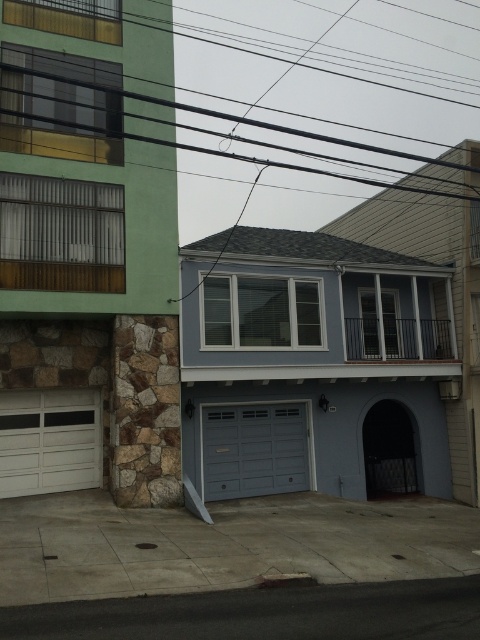
Is matte gray garage door at center thinner than black wire at upper center?

Correct, matte gray garage door at center's width is less than black wire at upper center's.

You are a GUI agent. You are given a task and a screenshot of the screen. Output one action in this format:
    pyautogui.click(x=<x>, y=<y>)
    Task: Click on the matte gray garage door at center
    The height and width of the screenshot is (640, 480).
    Given the screenshot: What is the action you would take?
    pyautogui.click(x=313, y=365)

Between matte gray garage door at center and white matte/glossy garage door at lower left, which one has less height?

Standing shorter between the two is white matte/glossy garage door at lower left.

Between point (257, 422) and point (52, 432), which one is positioned behind?

The point (257, 422) is more distant.

The width and height of the screenshot is (480, 640). Find the location of `matte gray garage door at center`. matte gray garage door at center is located at coordinates (313, 365).

Which is in front, point (41, 458) or point (279, 419)?

Positioned in front is point (41, 458).

You are a GUI agent. You are given a task and a screenshot of the screen. Output one action in this format:
    pyautogui.click(x=<x>, y=<y>)
    Task: Click on the white matte/glossy garage door at lower left
    
    Given the screenshot: What is the action you would take?
    pyautogui.click(x=48, y=442)

Locate an element on the screen. The height and width of the screenshot is (640, 480). white matte/glossy garage door at lower left is located at coordinates (48, 442).